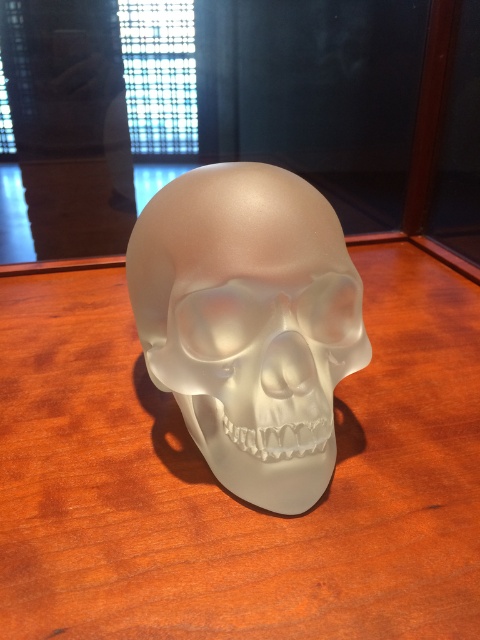
You are arranging items on a table and see the satin wood table at center and the satin white skull at center. Which object is positioned to the right side?

The satin white skull at center is positioned to the right of the satin wood table at center.

You are standing in front of a table and see a translucent, frosted skull placed centrally on a polished wooden surface. The coordinates of the table are given as point (228, 492). If you want to place a small candle on the table without blocking the view of the skull, where should you place it relative to the table?

The satin wood table at center is located at point (228, 492). To place the candle without blocking the view of the skull, position it away from the center towards the edge of the table, ensuring it does not obscure the central area where the skull is placed.

You are a photographer setting up a shot of the satin wood table at center and the satin white skull at center. You need to adjust your camera to focus on the object that is closer to the lens. Which object should you focus on?

The satin white skull at center is closer to the lens than the satin wood table at center, so you should focus on the satin white skull at center.